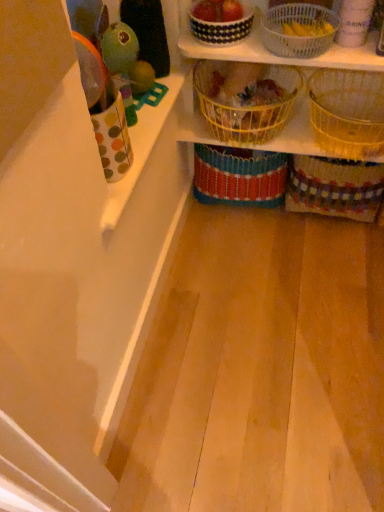
What are the coordinates of `free area behind polka dot fabric cup at left` in the screenshot? It's located at (142, 130).